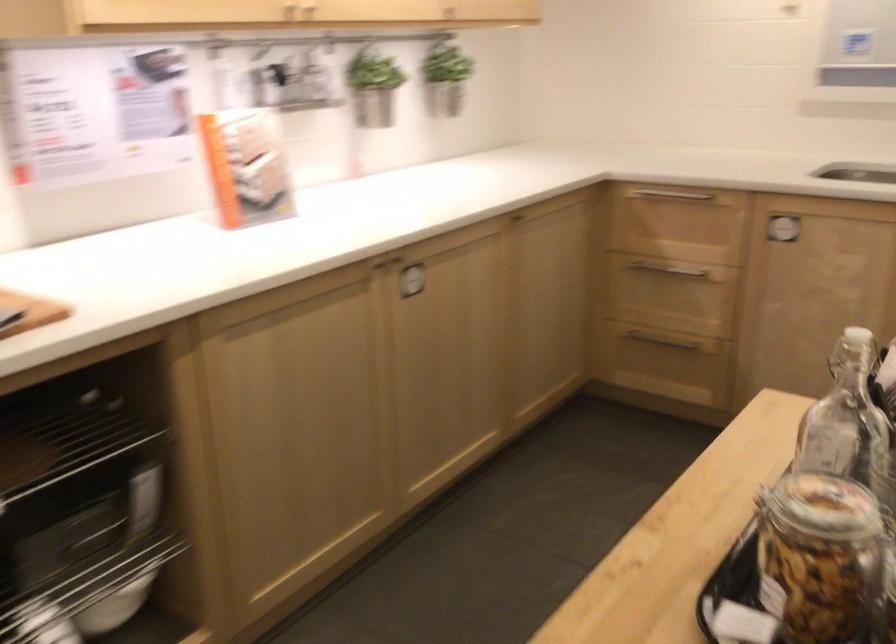
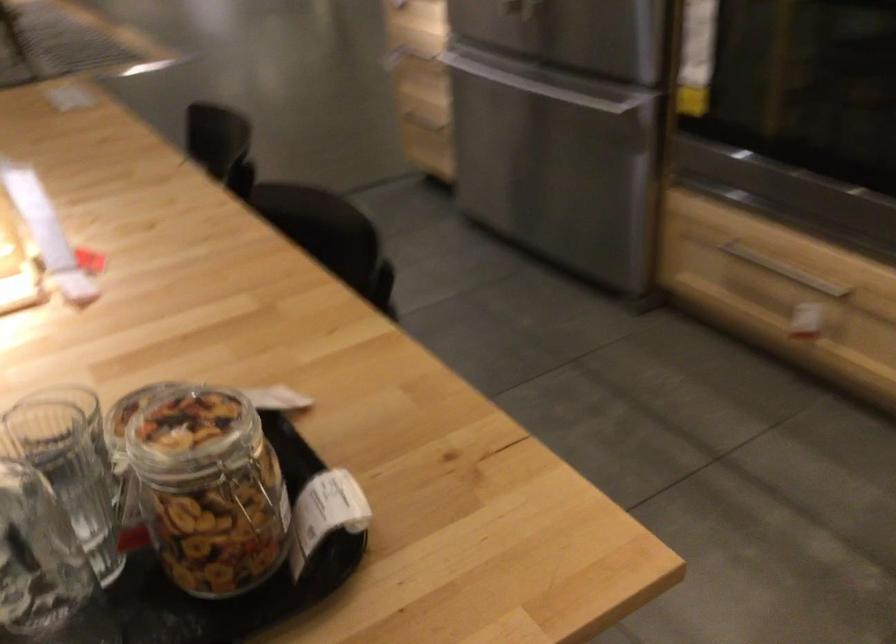
Where in the second image is the point corresponding to point (665, 534) from the first image?

(209, 489)